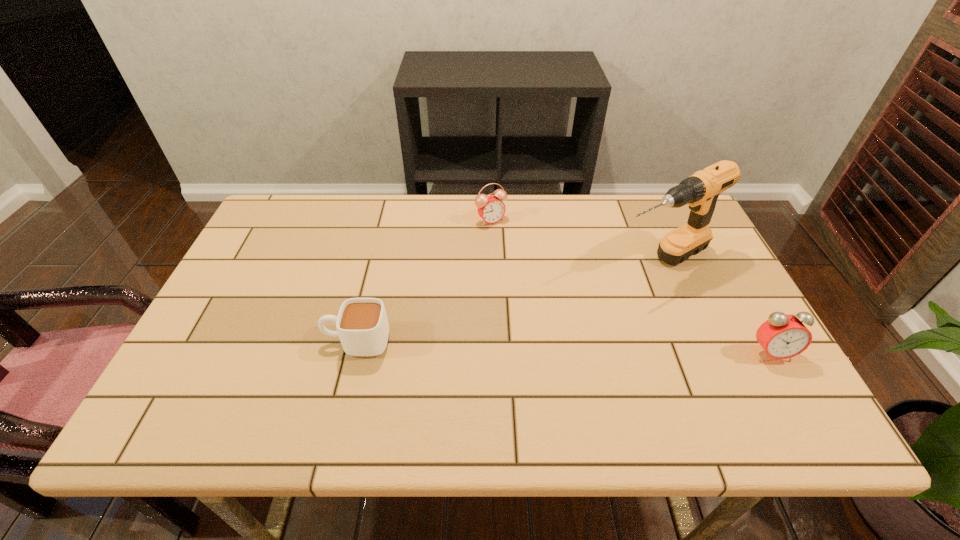
Locate an element on the screen. empty space that is in between the farthest object and the cup is located at coordinates (423, 281).

The image size is (960, 540). Find the location of `vacant point located between the shortest object and the nearer alarm clock`. vacant point located between the shortest object and the nearer alarm clock is located at coordinates (564, 347).

This screenshot has width=960, height=540. What are the coordinates of `blank region between the second farthest object and the right alarm clock` in the screenshot? It's located at (715, 307).

Locate an element on the screen. empty location between the leftmost object and the second object from left to right is located at coordinates (423, 281).

What are the coordinates of `free area in between the tallest object and the leftmost object` in the screenshot? It's located at (509, 301).

The width and height of the screenshot is (960, 540). Identify the location of blank region between the right alarm clock and the farthest object. (631, 287).

Identify the location of free spot between the tallest object and the right alarm clock. This screenshot has height=540, width=960. (715, 307).

Where is `free space between the cup and the third nearest object`? This screenshot has width=960, height=540. free space between the cup and the third nearest object is located at coordinates (509, 301).

You are a GUI agent. You are given a task and a screenshot of the screen. Output one action in this format:
    pyautogui.click(x=<x>, y=<y>)
    Task: Click on the free area in between the tallest object and the cup
    Image resolution: width=960 pixels, height=540 pixels.
    Given the screenshot: What is the action you would take?
    pyautogui.click(x=509, y=301)

This screenshot has width=960, height=540. I want to click on free space between the right alarm clock and the drill, so click(715, 307).